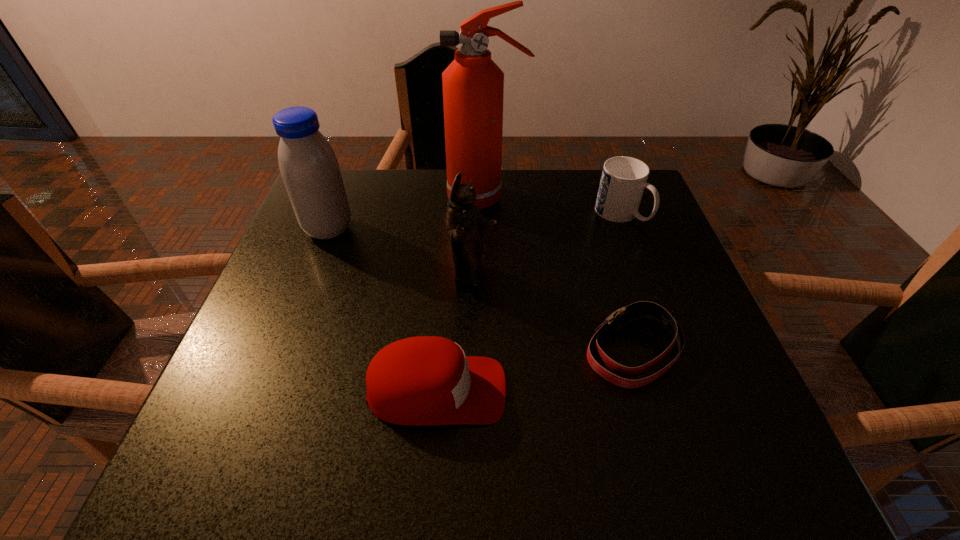
Identify the location of vacant space that satisfies the following two spatial constraints: 1. on the back side of the dog collar; 2. at the nozzle of the tallest object. (588, 199).

Locate an element on the screen. vacant region that satisfies the following two spatial constraints: 1. on the front side of the third shortest object; 2. on the front-facing side of the figurine is located at coordinates (644, 278).

Where is `free location that satisfies the following two spatial constraints: 1. on the back side of the shortest object; 2. at the nozzle of the tallest object`? free location that satisfies the following two spatial constraints: 1. on the back side of the shortest object; 2. at the nozzle of the tallest object is located at coordinates (588, 199).

Where is `vacant area that satisfies the following two spatial constraints: 1. at the nozzle of the dog collar; 2. on the right side of the fire extinguisher`? vacant area that satisfies the following two spatial constraints: 1. at the nozzle of the dog collar; 2. on the right side of the fire extinguisher is located at coordinates (488, 350).